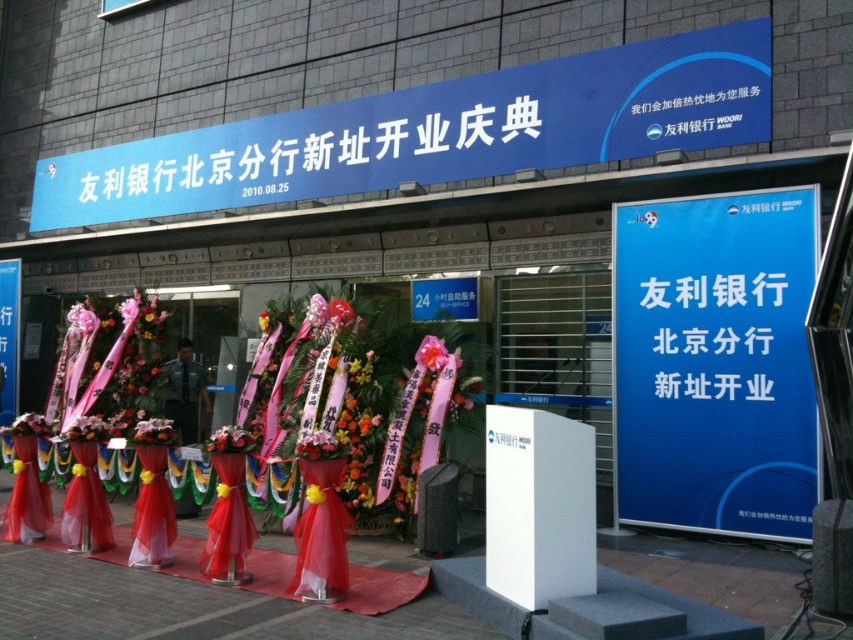
You are organizing a photo shoot at the entrance of the Woori Bank Beijing Branch. You need to place a large camera tripod that requires 1.2 meters of space. Considering the blue paperboard sign at right and the pink matte flower at center, which object should you move to ensure enough space?

The blue paperboard sign at right has a larger size compared to the pink matte flower at center, so you should move the blue paperboard sign at right to ensure enough space for the camera tripod.

You are a photographer positioned at the entrance of the Woori Bank Beijing Branch during the opening ceremony. You need to capture a photo that includes both the blue paperboard sign at right and the pink matte flower at center. Based on their positions, which object should you place on the left side of your camera frame to ensure both are visible?

You should place the pink matte flower at center on the left side of your camera frame because the blue paperboard sign at right is to the right of it, ensuring both are included in the frame.